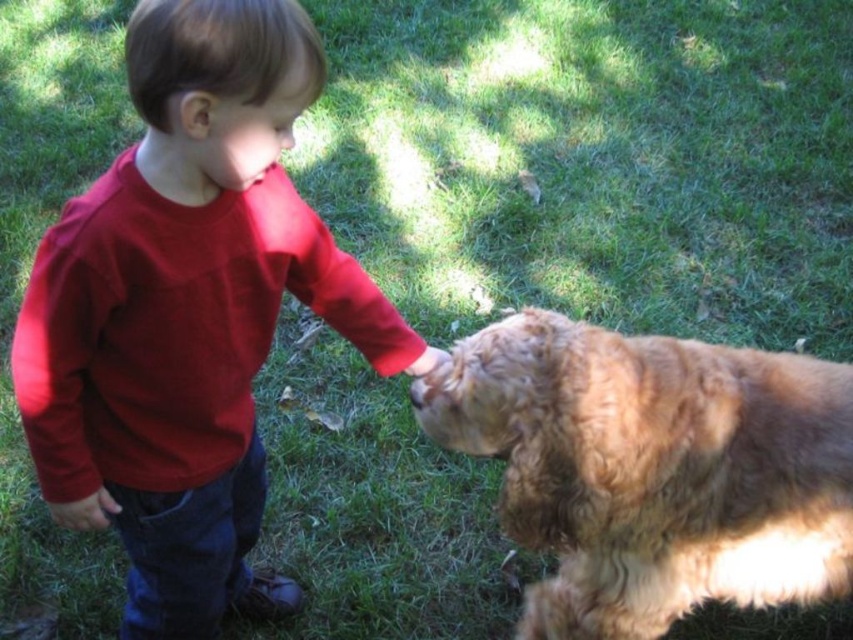
You are standing in the grassy lawn scene and want to place a small flag at the closest point to you between the two points labeled point [45,330] and point [651,364]. Which point should you choose?

You should choose point [45,330] because it is closer to the viewer than point [651,364].

In the scene shown: You are a photographer trying to capture the child and the dog in the image. If you want to focus on the smooth red shirt at center without blurring the golden fur dog at right, is it possible with a standard camera lens? Explain your reasoning based on their positions.

The smooth red shirt at center is closer to the viewer than the golden fur dog at right. With a standard camera lens, focusing on the smooth red shirt at center would likely blur the golden fur dog at right since they are at different distances. To keep both in focus, a smaller aperture or a lens with a greater depth of field would be needed.

You are a photographer trying to capture the interaction between the smooth red shirt at center and the golden fur dog at right. Based on their positions, which object is closer to the left edge of the photo?

The smooth red shirt at center is positioned on the left side of the golden fur dog at right, so it is closer to the left edge of the photo.